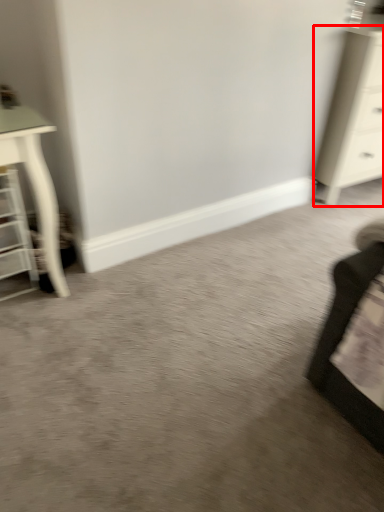
Question: From the image's perspective, what is the correct spatial relationship of chest of drawers (annotated by the red box) in relation to shelf?

Choices:
 (A) above
 (B) below

Answer: (A)